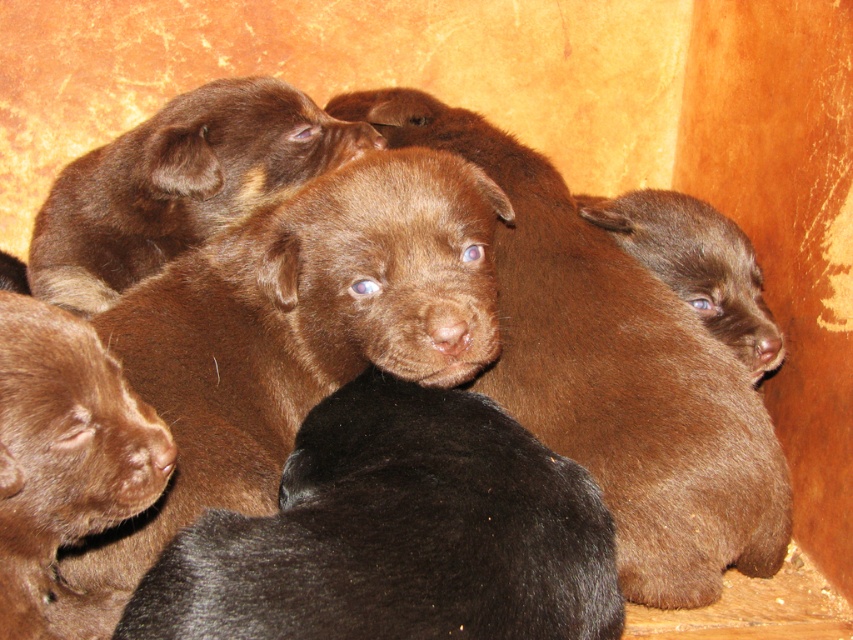
Based on the photo, you are a photographer trying to capture the black puppy in the foreground. You notice two points in the scene labeled as point [281,148] and point [738,339]. Which point is closer to you and why?

Point [281,148] is closer to the viewer than point [738,339] because it is positioned in front of the other point in the scene.

You are a veterinarian examining the puppies. You need to check the brown furry puppy at center and the brown fur puppy at center. Which one is closer to you?

The brown furry puppy at center is closer to you because it is in front of the brown fur puppy at center.

Where is the brown furry puppy at center located in the image?

The brown furry puppy at center is located at point (178, 184).